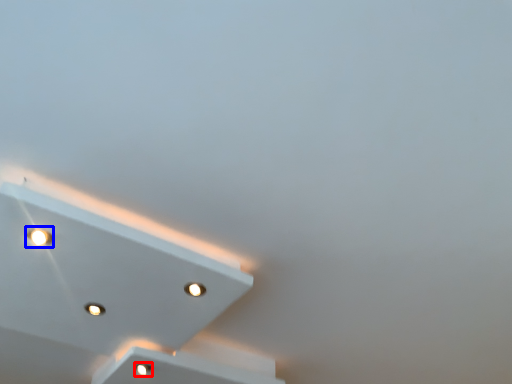
Question: Which object is further to the camera taking this photo, dot (highlighted by a red box) or dot (highlighted by a blue box)?

Choices:
 (A) dot
 (B) dot

Answer: (A)